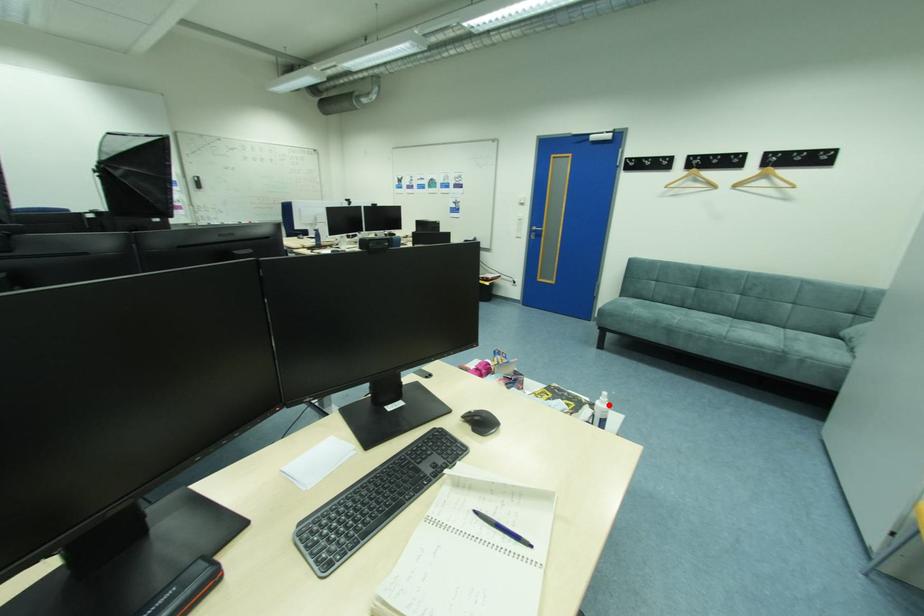
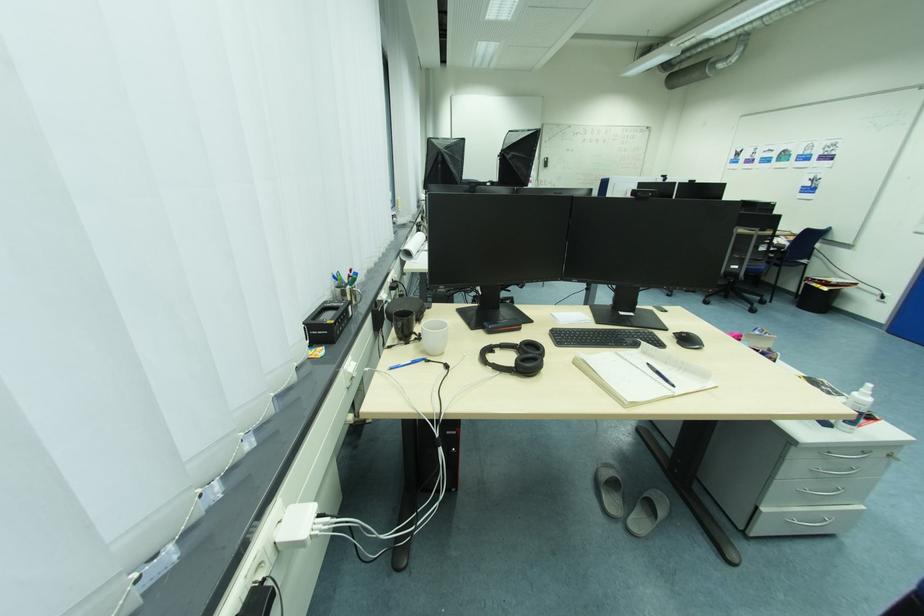
Where in the second image is the point corresponding to the highlighted location from the first image?

(869, 398)